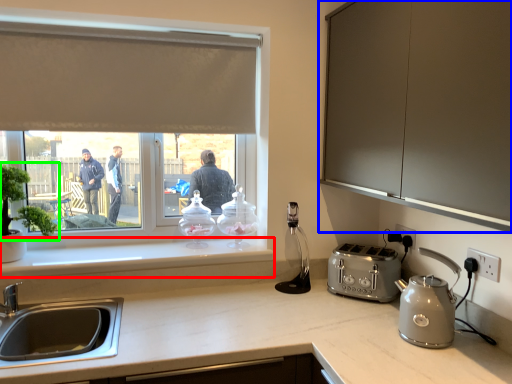
Question: Which is nearer to the window sill (highlighted by a red box)? cabinetry (highlighted by a blue box) or plant (highlighted by a green box).

Choices:
 (A) cabinetry
 (B) plant

Answer: (B)